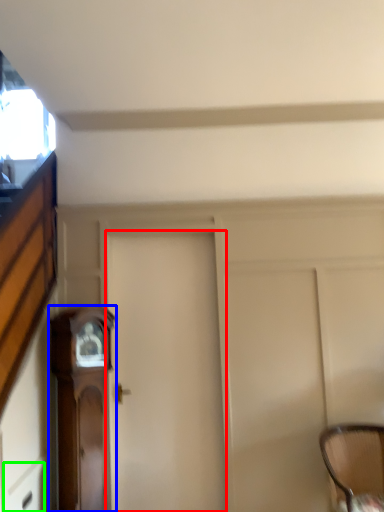
Question: Which object is positioned farthest from door (highlighted by a red box)? Select from furniture (highlighted by a blue box) and drawer (highlighted by a green box).

Choices:
 (A) furniture
 (B) drawer

Answer: (B)